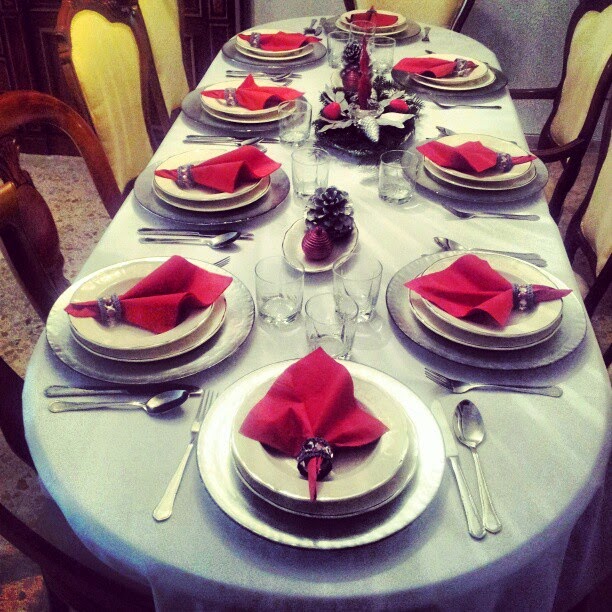
Where is `place settings`? The height and width of the screenshot is (612, 612). place settings is located at coordinates (329, 534), (567, 316), (56, 330), (139, 173), (188, 101), (229, 42), (333, 15), (480, 65), (520, 176).